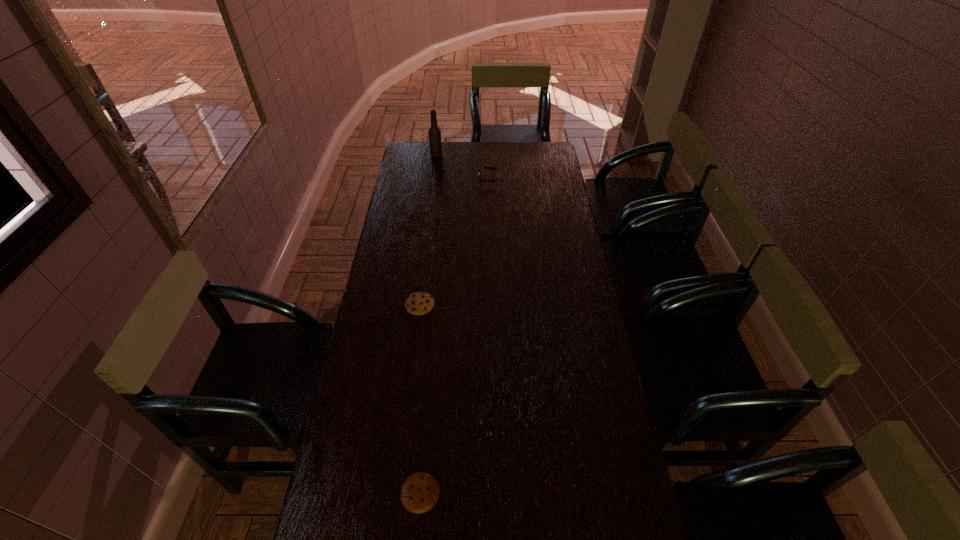
At what (x,y) coordinates should I click in order to perform the action: click on empty space between the nearest object and the farther cookie. Please return your answer as a coordinate pair (x, y). This screenshot has height=540, width=960. Looking at the image, I should click on (420, 399).

The image size is (960, 540). What are the coordinates of `object identified as the third closest to the taller cookie` in the screenshot? It's located at (434, 132).

Select which object appears as the second closest to the third farthest object. Please provide its 2D coordinates. Your answer should be formatted as a tuple, i.e. [(x, y)], where the tuple contains the x and y coordinates of a point satisfying the conditions above.

[(491, 168)]

You are a GUI agent. You are given a task and a screenshot of the screen. Output one action in this format:
    pyautogui.click(x=<x>, y=<y>)
    Task: Click on the free space that satisfies the following two spatial constraints: 1. on the front-facing side of the sunglasses; 2. on the front side of the taller cookie
    
    Given the screenshot: What is the action you would take?
    pyautogui.click(x=494, y=305)

I want to click on free point that satisfies the following two spatial constraints: 1. on the side of the tallest object with the label; 2. on the left side of the taller cookie, so click(x=417, y=305).

At what (x,y) coordinates should I click in order to perform the action: click on vacant space that satisfies the following two spatial constraints: 1. on the side of the beer bottle with the label; 2. on the left side of the farther cookie. Please return your answer as a coordinate pair (x, y). Image resolution: width=960 pixels, height=540 pixels. Looking at the image, I should click on 417,305.

You are a GUI agent. You are given a task and a screenshot of the screen. Output one action in this format:
    pyautogui.click(x=<x>, y=<y>)
    Task: Click on the vacant space that satisfies the following two spatial constraints: 1. on the side of the nearer cookie with the label; 2. on the left side of the tallest object
    The image size is (960, 540).
    Given the screenshot: What is the action you would take?
    pyautogui.click(x=393, y=492)

Where is `vacant space that satisfies the following two spatial constraints: 1. on the side of the tallest object with the label; 2. on the back side of the farther cookie`? vacant space that satisfies the following two spatial constraints: 1. on the side of the tallest object with the label; 2. on the back side of the farther cookie is located at coordinates (417, 305).